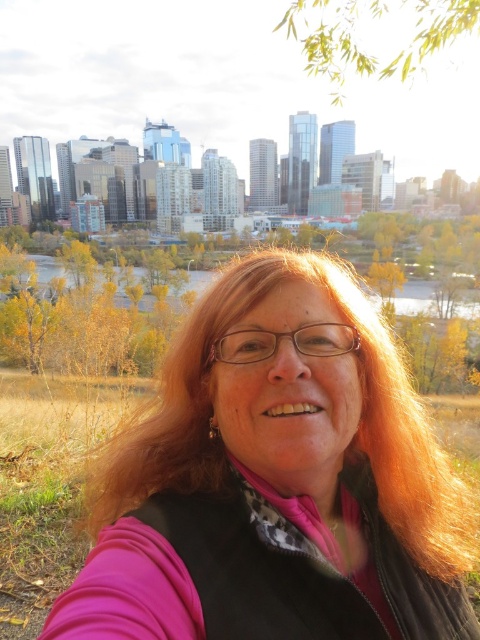
Question: Does pink fabric at center appear over yellow-green leaves at upper center?

Choices:
 (A) yes
 (B) no

Answer: (B)

Question: Is pink fabric at center below yellow-green leaves at upper center?

Choices:
 (A) yes
 (B) no

Answer: (A)

Question: Which point is farther from the camera taking this photo?

Choices:
 (A) (343, 17)
 (B) (389, 358)

Answer: (A)

Question: Is the position of pink fabric at center less distant than that of yellow-green leaves at upper center?

Choices:
 (A) no
 (B) yes

Answer: (B)